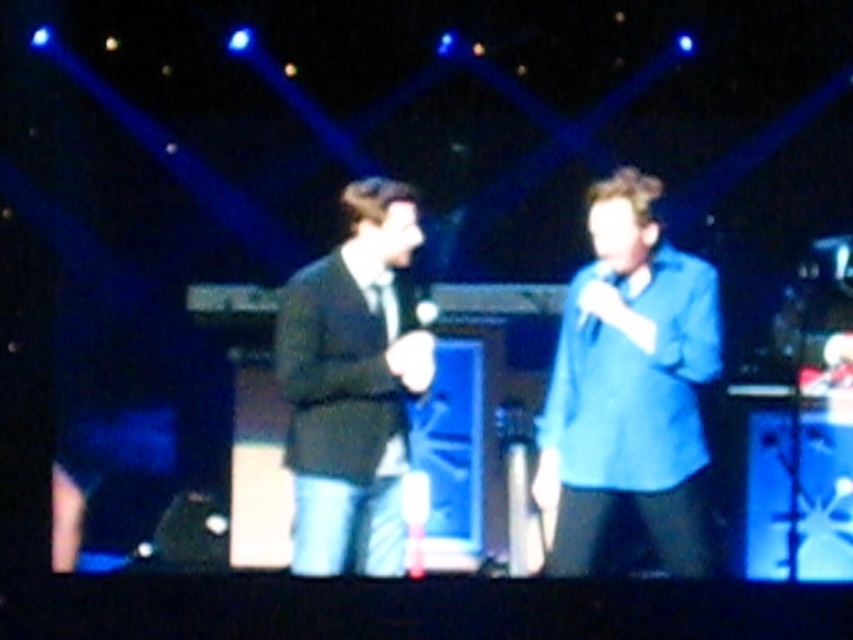
You are an audience member sitting in the front row of the concert. You notice two points on the stage, one at coordinate point [639,401] and another at point [341,200]. Which point is closer to you?

Point [639,401] is closer to the camera than point [341,200], so the point at coordinate [639,401] is closer to you as an audience member.

You are an event planner setting up a stage for a performance. You need to ensure that the matte black suit at center and the white matte microphone at center are visible to the audience. Based on their sizes, which object should you place closer to the front to ensure visibility?

The matte black suit at center is taller than the white matte microphone at center, so to ensure visibility for both objects, the white matte microphone at center should be placed closer to the front since it is shorter and might be obscured by the taller matte black suit at center.

You are a photographer at the back of the venue and want to take a photo of both the blue matte shirt at center and the matte black suit at center. Which one should you focus on first to ensure both are in focus?

You should focus on the blue matte shirt at center first because it is in front of the matte black suit at center, so adjusting focus starting from the front ensures both are in focus.